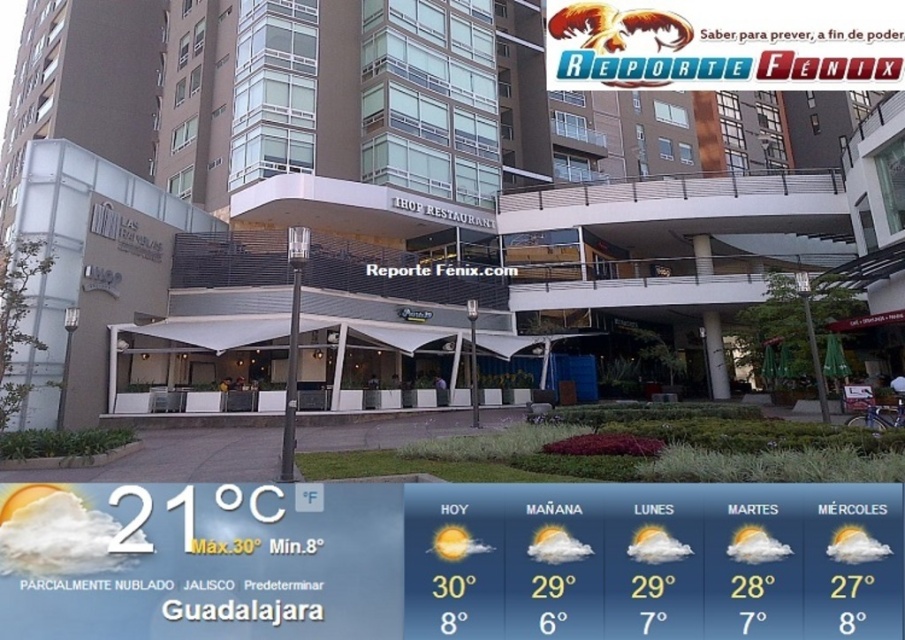
Question: Which point is farther to the camera?

Choices:
 (A) (669, 513)
 (B) (718, 225)

Answer: (B)

Question: Is white awning at center closer to the viewer compared to white cloud weather forecast at lower left?

Choices:
 (A) no
 (B) yes

Answer: (A)

Question: Where is white awning at center located in relation to white cloud weather forecast at lower left in the image?

Choices:
 (A) right
 (B) left

Answer: (A)

Question: Among these points, which one is farthest from the camera?

Choices:
 (A) (270, 554)
 (B) (55, 348)

Answer: (B)

Question: Which point appears closest to the camera in this image?

Choices:
 (A) (889, 486)
 (B) (121, 8)

Answer: (A)

Question: Is white awning at center thinner than white cloud weather forecast at lower left?

Choices:
 (A) no
 (B) yes

Answer: (A)